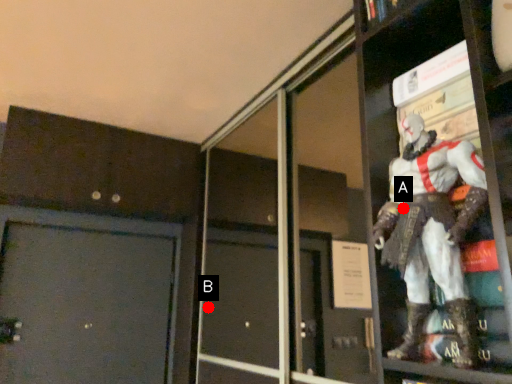
Question: Two points are circled on the image, labeled by A and B beside each circle. Which point is farther to the camera?

Choices:
 (A) A is further
 (B) B is further

Answer: (B)